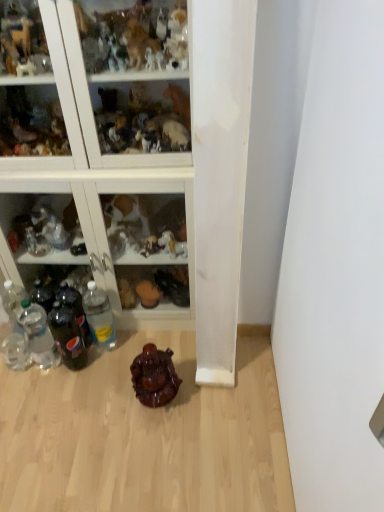
The height and width of the screenshot is (512, 384). Find the location of `free space in front of clear plastic bottles at left, the 4th bottle when ordered from right to left`. free space in front of clear plastic bottles at left, the 4th bottle when ordered from right to left is located at coordinates (44, 395).